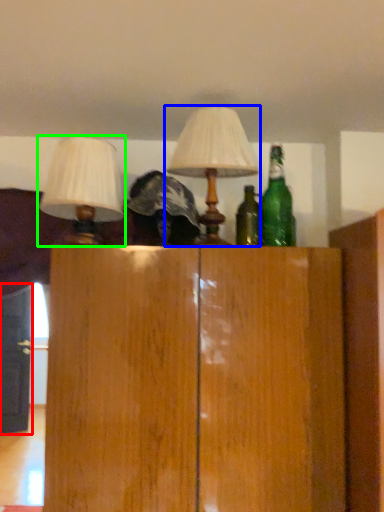
Question: Which object is the farthest from door (highlighted by a red box)? Choose among these: lamp (highlighted by a blue box) or lamp (highlighted by a green box).

Choices:
 (A) lamp
 (B) lamp

Answer: (A)